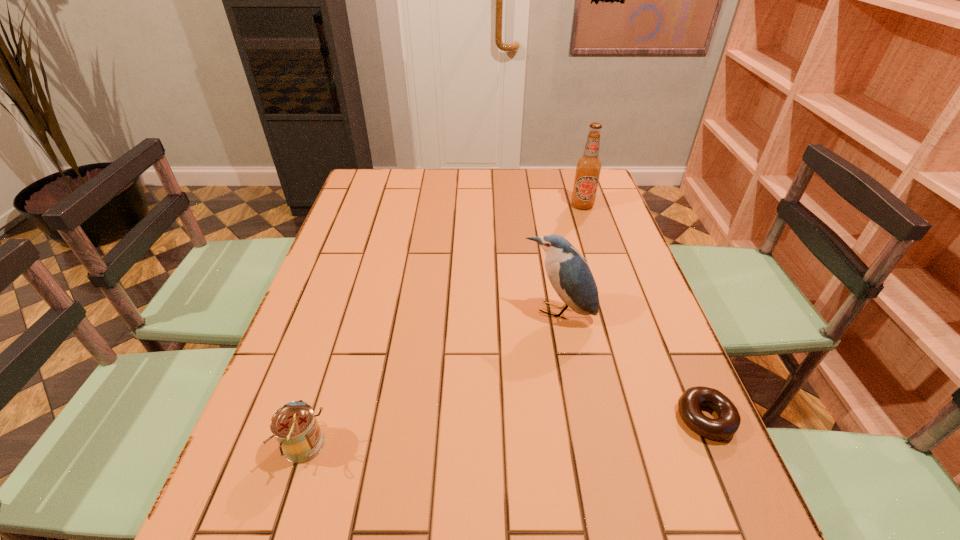
Locate an element on the screen. vacant space that satisfies the following two spatial constraints: 1. on the front side of the second object from left to right; 2. on the right side of the shortest object is located at coordinates (578, 418).